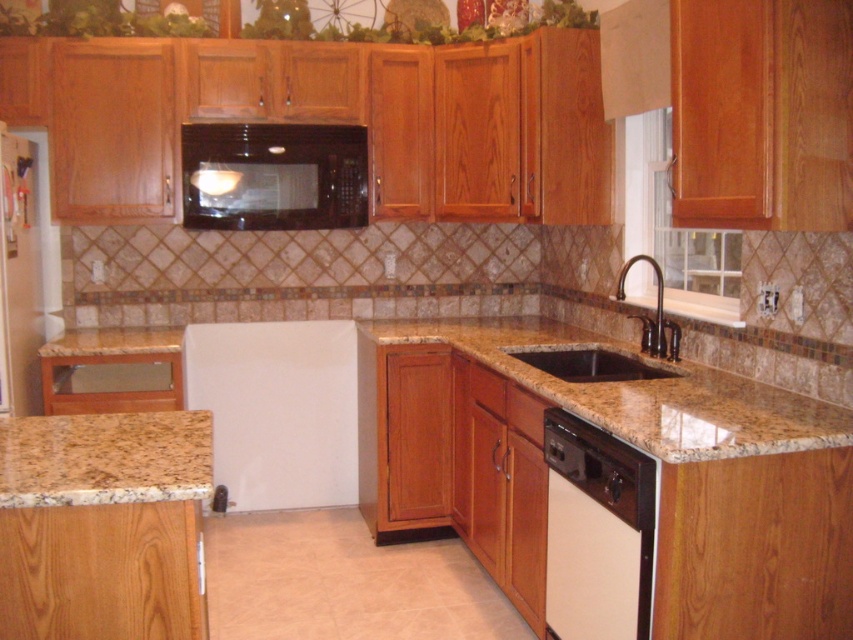
Between white glossy dishwasher at lower center and black glossy microwave at upper center, which one appears on the left side from the viewer's perspective?

Positioned to the left is black glossy microwave at upper center.

Does white glossy dishwasher at lower center have a lesser height compared to black glossy microwave at upper center?

No, white glossy dishwasher at lower center is not shorter than black glossy microwave at upper center.

The width and height of the screenshot is (853, 640). I want to click on white glossy dishwasher at lower center, so click(596, 532).

This screenshot has height=640, width=853. Identify the location of white glossy dishwasher at lower center. (596, 532).

Does white glossy dishwasher at lower center have a lesser width compared to brown granite countertop at lower left?

Yes.

Who is positioned more to the right, white glossy dishwasher at lower center or brown granite countertop at lower left?

white glossy dishwasher at lower center

Does point (579, 497) come closer to viewer compared to point (192, 412)?

No, it is not.

Find the location of a particular element. white glossy dishwasher at lower center is located at coordinates (596, 532).

In the scene shown: Which is above, brown granite countertop at lower left or oil rubbed bronze faucet at upper right?

Positioned higher is oil rubbed bronze faucet at upper right.

Which is in front, point (86, 458) or point (674, 349)?

Point (86, 458)

I want to click on brown granite countertop at lower left, so click(105, 458).